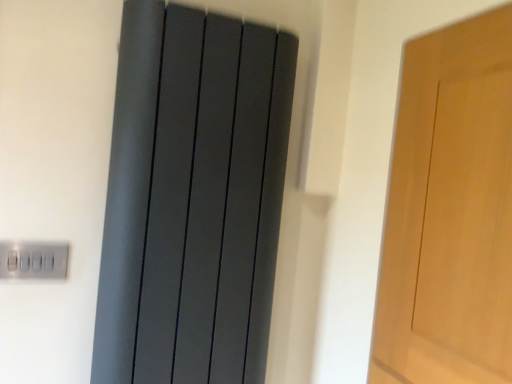
Question: Looking at the image, does satin silver switch at lower left seem bigger or smaller compared to matte gray radiator at center?

Choices:
 (A) big
 (B) small

Answer: (B)

Question: Visually, is satin silver switch at lower left positioned to the left or to the right of matte gray radiator at center?

Choices:
 (A) left
 (B) right

Answer: (A)

Question: Is satin silver switch at lower left inside or outside of matte gray radiator at center?

Choices:
 (A) inside
 (B) outside

Answer: (B)

Question: Considering the positions of point (179, 259) and point (60, 243), is point (179, 259) closer or farther from the camera than point (60, 243)?

Choices:
 (A) closer
 (B) farther

Answer: (A)

Question: Is matte gray radiator at center to the left or to the right of satin silver switch at lower left in the image?

Choices:
 (A) right
 (B) left

Answer: (A)

Question: Is matte gray radiator at center spatially inside satin silver switch at lower left, or outside of it?

Choices:
 (A) inside
 (B) outside

Answer: (B)

Question: From the image's perspective, is matte gray radiator at center positioned above or below satin silver switch at lower left?

Choices:
 (A) below
 (B) above

Answer: (B)